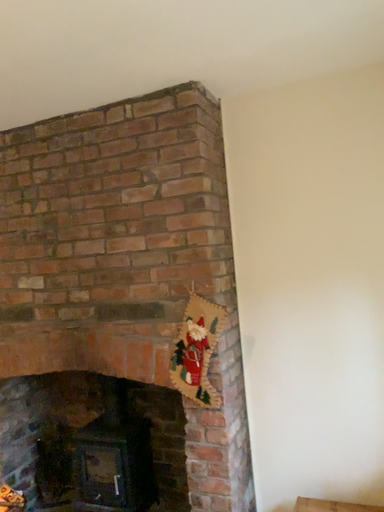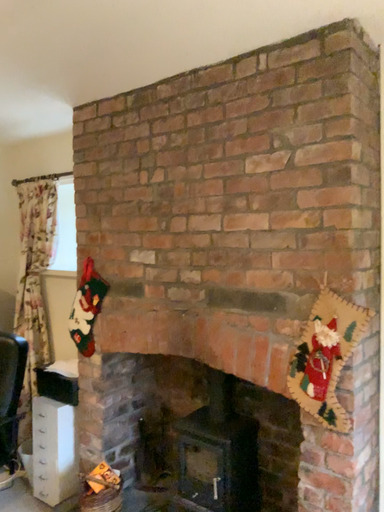
Question: Which way did the camera rotate in the video?

Choices:
 (A) rotated right
 (B) rotated left

Answer: (B)